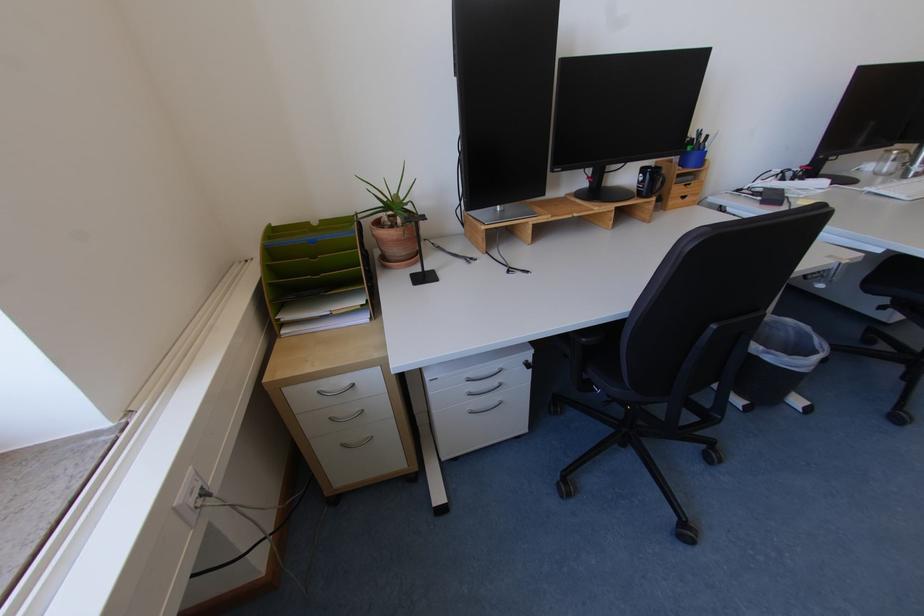
What do you see at coordinates (604, 366) in the screenshot? I see `the chair sitting surface` at bounding box center [604, 366].